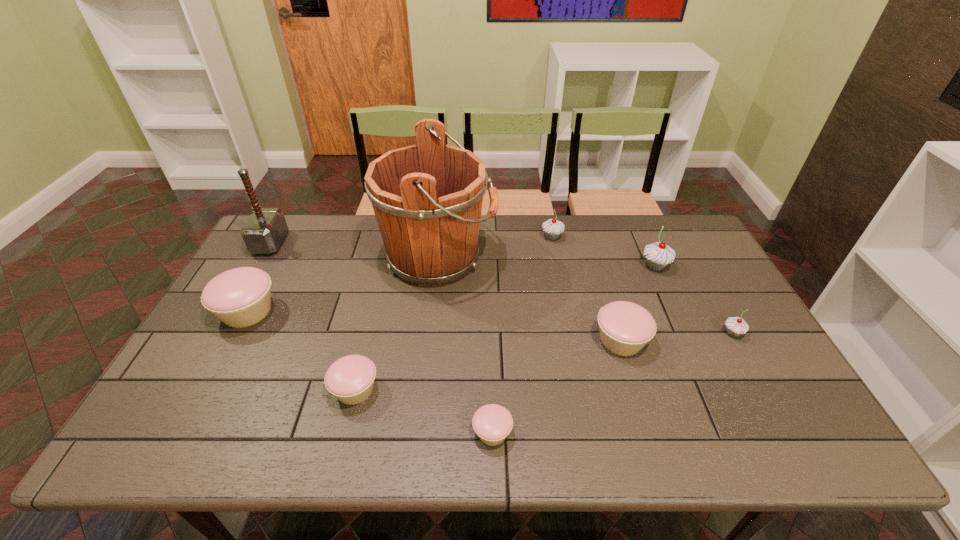
Identify the location of vacant area located 0.380m on the right of the farthest cupcake. This screenshot has width=960, height=540. click(672, 237).

This screenshot has width=960, height=540. Identify the location of vacant space located 0.150m on the front of the leftmost cupcake. (209, 381).

Find the location of a particular element. vacant space located on the back of the third cupcake from right to left is located at coordinates (591, 244).

Where is `free space located 0.400m on the back of the nearest gray cupcake`? This screenshot has height=540, width=960. free space located 0.400m on the back of the nearest gray cupcake is located at coordinates (680, 239).

The height and width of the screenshot is (540, 960). In order to click on free point located on the back of the second nearest cupcake in this screenshot , I will do `click(365, 350)`.

Identify the location of free space located on the back of the nearest pink cupcake. (491, 353).

Identify the location of bucket that is at the far edge. This screenshot has height=540, width=960. (427, 198).

You are a GUI agent. You are given a task and a screenshot of the screen. Output one action in this format:
    pyautogui.click(x=<x>, y=<y>)
    Task: Click on the hammer that is at the far edge
    The height and width of the screenshot is (540, 960).
    Given the screenshot: What is the action you would take?
    pyautogui.click(x=264, y=231)

Locate an element on the screen. Image resolution: width=960 pixels, height=540 pixels. cupcake located in the far edge section of the desktop is located at coordinates (553, 228).

This screenshot has width=960, height=540. I want to click on object situated at the near edge, so click(x=492, y=423).